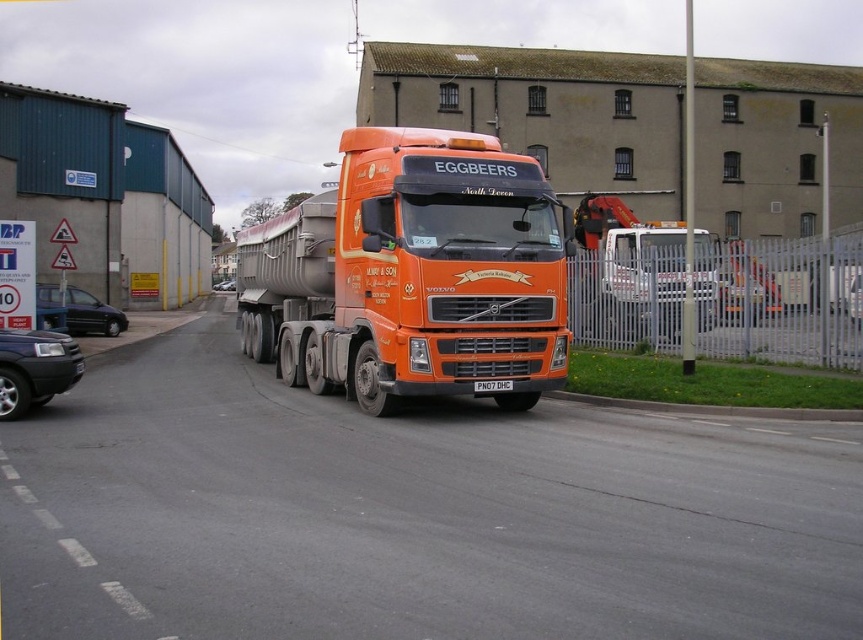
Question: Does orange metallic truck at right appear on the right side of metallic silver car at center?

Choices:
 (A) no
 (B) yes

Answer: (B)

Question: Based on their relative distances, which object is nearer to the matte black car at lower left?

Choices:
 (A) shiny black car at left
 (B) orange matte truck at center
 (C) orange metallic truck at right

Answer: (B)

Question: Does orange matte truck at center have a greater width compared to metallic silver car at center?

Choices:
 (A) no
 (B) yes

Answer: (B)

Question: Which of these objects is positioned closest to the black plastic license plate at center?

Choices:
 (A) orange metallic truck at right
 (B) shiny black car at left

Answer: (A)

Question: Can you confirm if orange matte truck at center is positioned below orange metallic truck at right?

Choices:
 (A) no
 (B) yes

Answer: (A)

Question: Among these points, which one is farthest from the camera?

Choices:
 (A) (263, 272)
 (B) (484, 387)
 (C) (231, 285)
 (D) (49, 321)

Answer: (C)